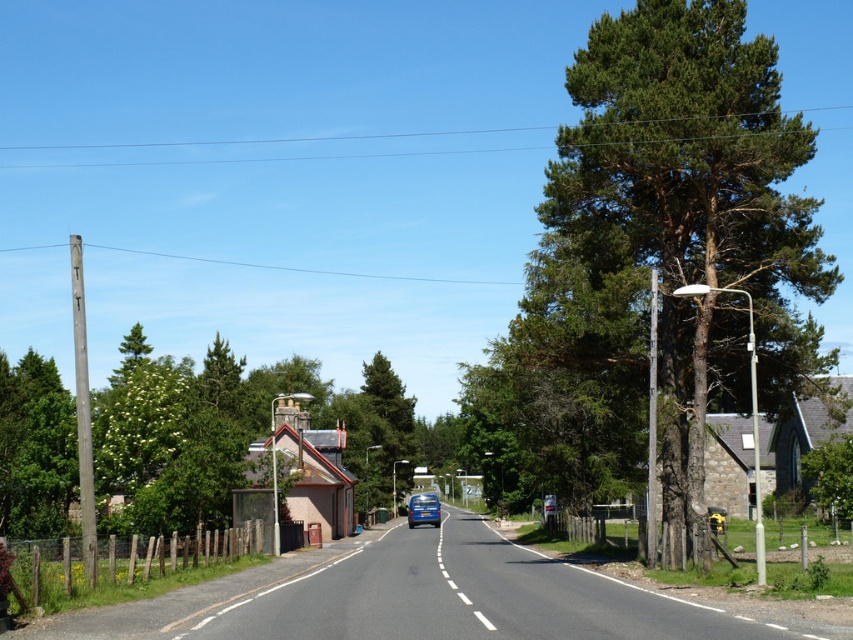
You are a hiker standing on the road and want to take a photo of both the green textured tree at right and the green textured tree at center. Which tree should you move closer to in order to include both in the frame without cropping either?

You should move closer to the green textured tree at center because it is shorter than the green textured tree at right, allowing both to fit within the frame when positioned nearer to the shorter tree.